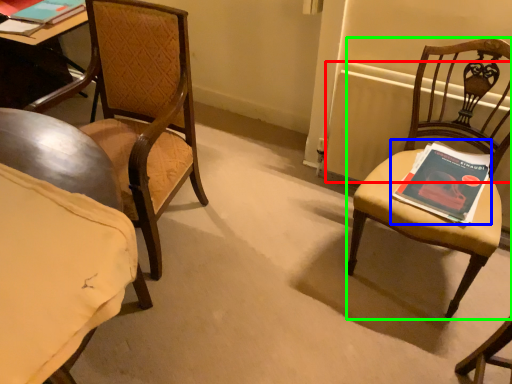
Question: Which object is the closest to the radiator (highlighted by a red box)? Choose among these: book (highlighted by a blue box) or chair (highlighted by a green box).

Choices:
 (A) book
 (B) chair

Answer: (B)